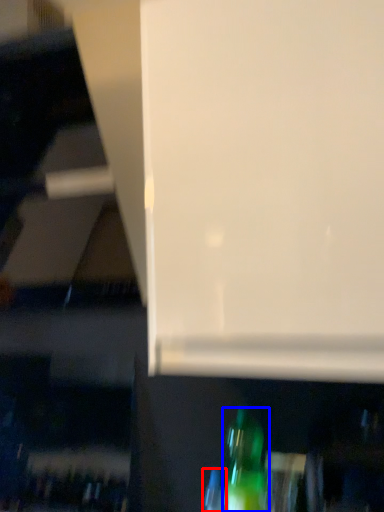
Question: Which point is further to the camera, bottle (highlighted by a red box) or bottle (highlighted by a blue box)?

Choices:
 (A) bottle
 (B) bottle

Answer: (A)